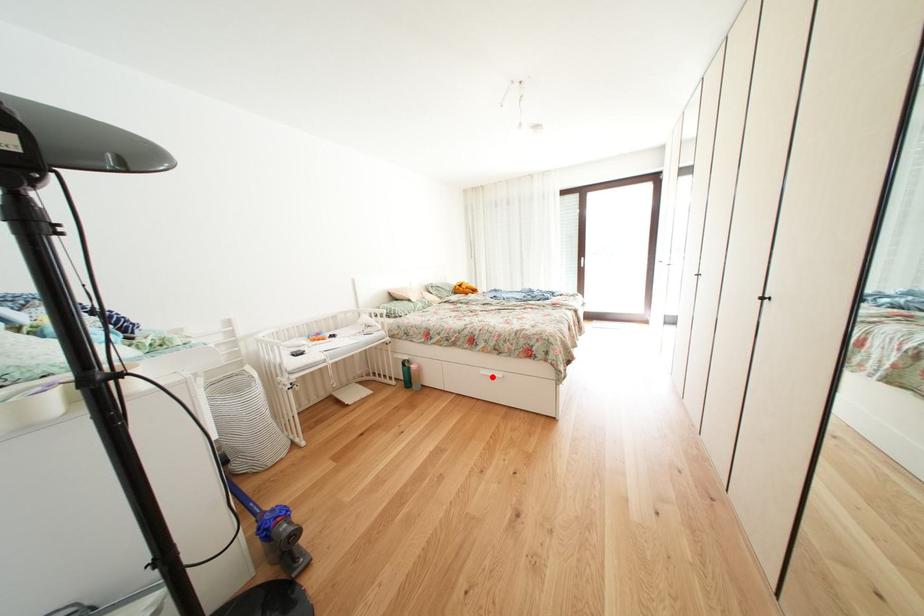
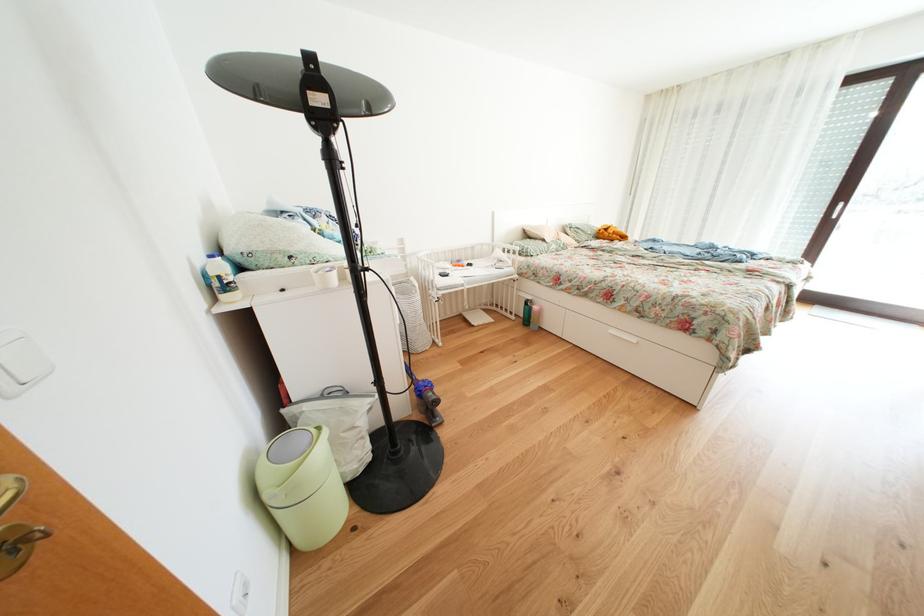
Question: I am providing you with two images of the same scene from different viewpoints. Given a red point in image1, look at the same physical point in image2. Is it:

Choices:
 (A) Closer to the viewpoint
 (B) Farther from the viewpoint

Answer: (A)